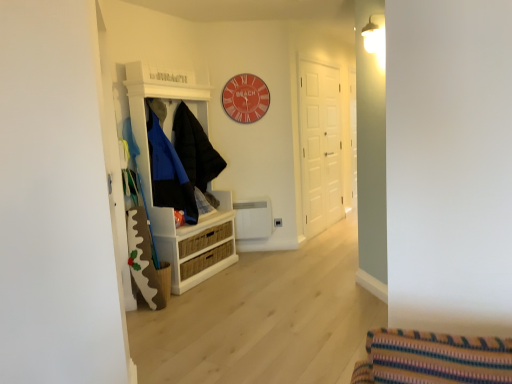
Question: From a real-world perspective, relative to white matte door at center, is white wood cabinet at left vertically above or below?

Choices:
 (A) below
 (B) above

Answer: (A)

Question: Looking at the image, does white wood cabinet at left seem bigger or smaller compared to white matte door at center?

Choices:
 (A) small
 (B) big

Answer: (B)

Question: Which of these objects is positioned farthest from the matte red clock at upper center?

Choices:
 (A) white wood cabinet at left
 (B) matte black jacket at left, which ranks as the 2th clothing in back-to-front order
 (C) black puffy jacket at center, the 1th clothing positioned from the back
 (D) white matte door at center

Answer: (B)

Question: Estimate the real-world distances between objects in this image. Which object is farther from the white wood cabinet at left?

Choices:
 (A) black puffy jacket at center, the 1th clothing positioned from the back
 (B) matte red clock at upper center
 (C) white matte door at center
 (D) matte black jacket at left, which ranks as the 2th clothing in back-to-front order

Answer: (C)